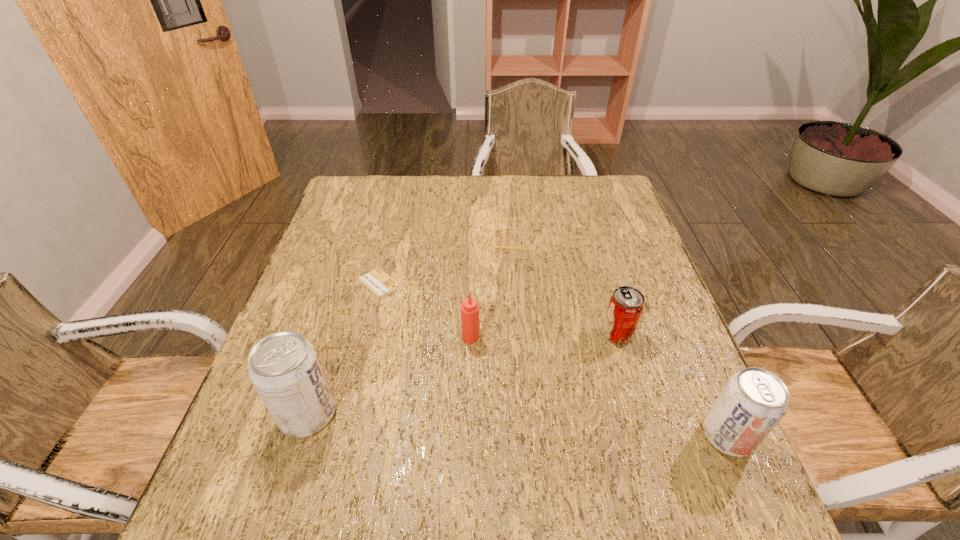
Locate an element on the screen. The image size is (960, 540). the leftmost pop soda is located at coordinates 284,368.

Locate an element on the screen. Image resolution: width=960 pixels, height=540 pixels. the tallest pop soda is located at coordinates (284, 368).

The image size is (960, 540). I want to click on the rightmost pop soda, so click(754, 400).

Identify the location of the second shortest pop soda. (754, 400).

What are the coordinates of `the fifth tallest object` in the screenshot? It's located at (495, 220).

Identify the location of the farthest object. Image resolution: width=960 pixels, height=540 pixels. (495, 220).

Locate an element on the screen. The height and width of the screenshot is (540, 960). Tabasco sauce is located at coordinates (469, 308).

Identify the location of identity card. The width and height of the screenshot is (960, 540). (377, 281).

Find the location of a particular element. Image resolution: width=960 pixels, height=540 pixels. the shortest object is located at coordinates (377, 281).

Locate an element on the screen. the fifth object from left to right is located at coordinates (626, 304).